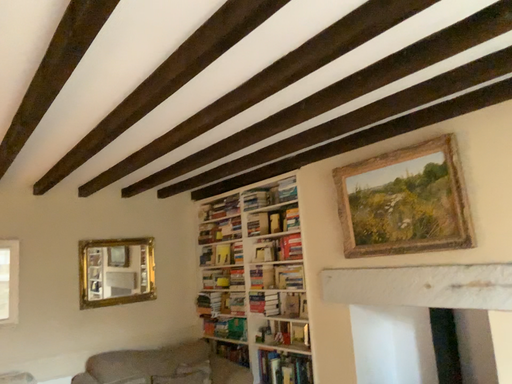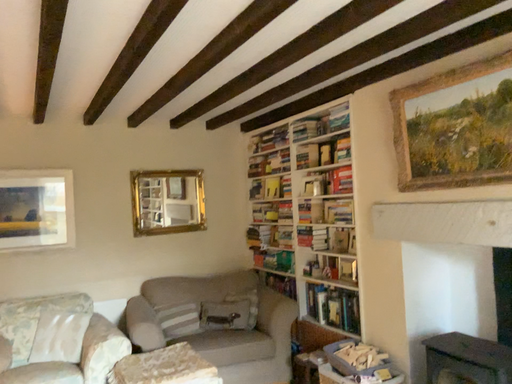
Question: How did the camera likely rotate when shooting the video?

Choices:
 (A) rotated right
 (B) rotated left

Answer: (B)